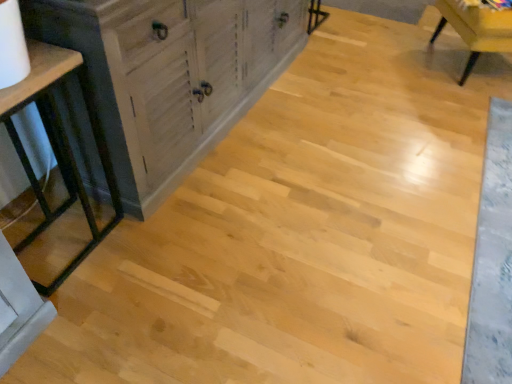
You are a GUI agent. You are given a task and a screenshot of the screen. Output one action in this format:
    pyautogui.click(x=<x>, y=<y>)
    Task: Click on the free space to the right of matte black table at left
    This screenshot has width=512, height=384.
    Given the screenshot: What is the action you would take?
    pyautogui.click(x=150, y=253)